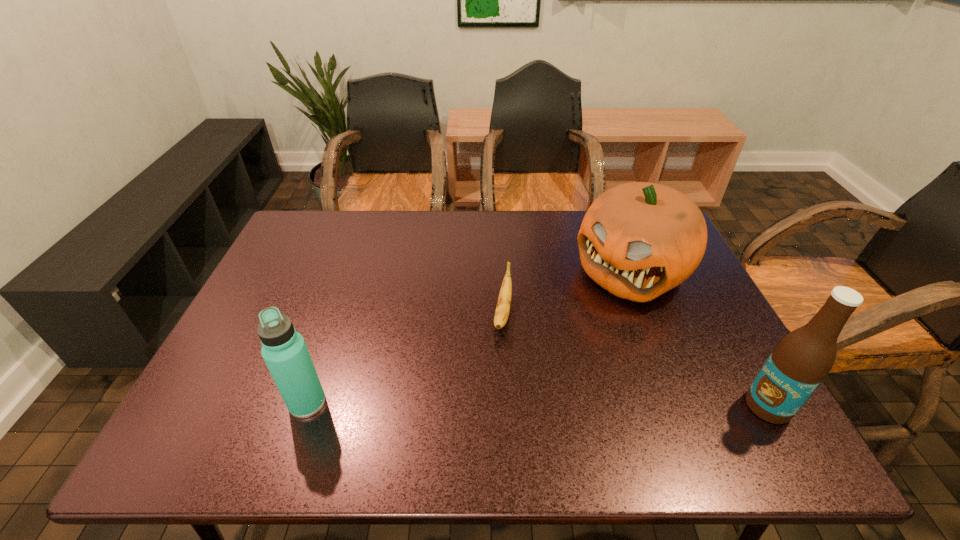
In the image, there is a desktop. Find the location of `blank space at the far edge`. blank space at the far edge is located at coordinates (x=544, y=221).

The height and width of the screenshot is (540, 960). In order to click on vacant area at the near edge of the desktop in this screenshot , I will do `click(671, 397)`.

In the image, there is a desktop. Where is `vacant space at the left edge`? vacant space at the left edge is located at coordinates (239, 323).

This screenshot has height=540, width=960. Identify the location of vacant area at the right edge of the desktop. (689, 336).

Image resolution: width=960 pixels, height=540 pixels. I want to click on free space at the near left corner of the desktop, so click(x=236, y=389).

In order to click on vacant area at the near right corner of the desktop in this screenshot , I will do `click(715, 394)`.

At what (x,y) coordinates should I click in order to perform the action: click on vacant area between the pumpkin and the second object from left to right. Please return your answer as a coordinate pair (x, y). The image size is (960, 540). Looking at the image, I should click on (566, 293).

Find the location of a particular element. The width and height of the screenshot is (960, 540). free space between the pumpkin and the tallest object is located at coordinates (700, 339).

The width and height of the screenshot is (960, 540). Identify the location of vacant space in between the pumpkin and the leftmost object. (469, 337).

The width and height of the screenshot is (960, 540). Find the location of `empty space between the leftmost object and the second object from left to right`. empty space between the leftmost object and the second object from left to right is located at coordinates (405, 358).